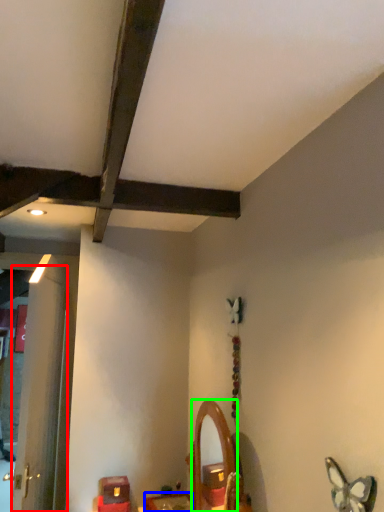
Question: Which object is the farthest from door (highlighted by a red box)? Choose among these: furniture (highlighted by a blue box) or mirror (highlighted by a green box).

Choices:
 (A) furniture
 (B) mirror

Answer: (B)